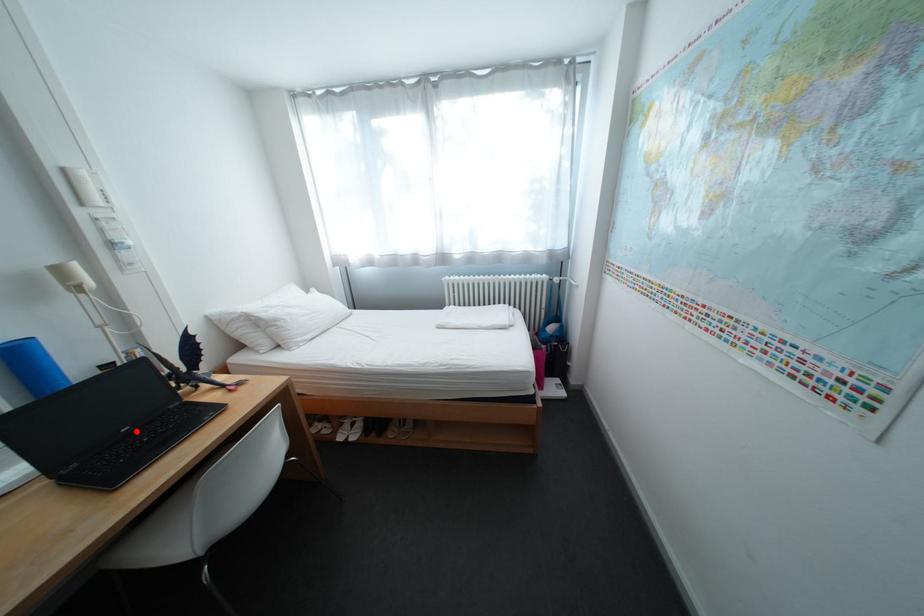
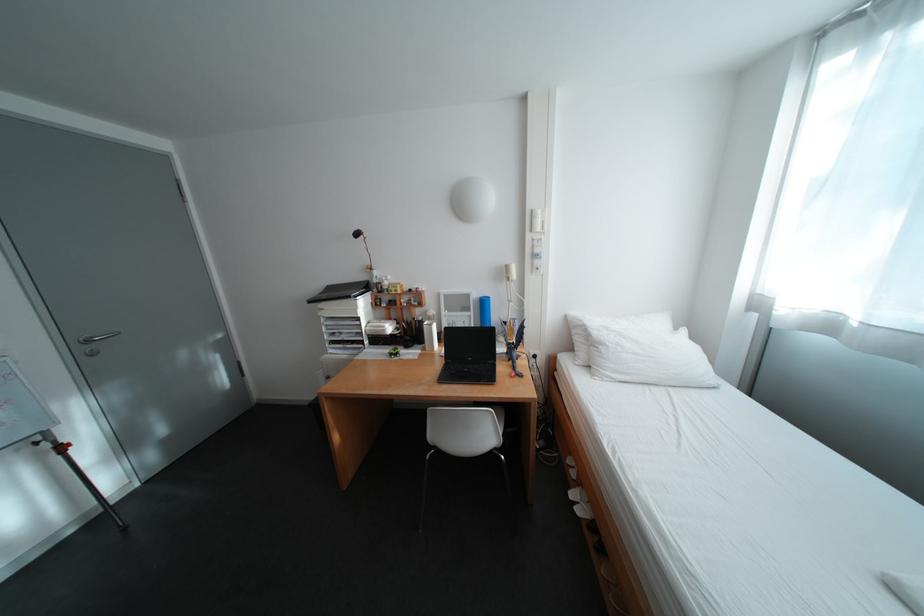
The point at the highlighted location is marked in the first image. Where is the corresponding point in the second image?

(481, 360)